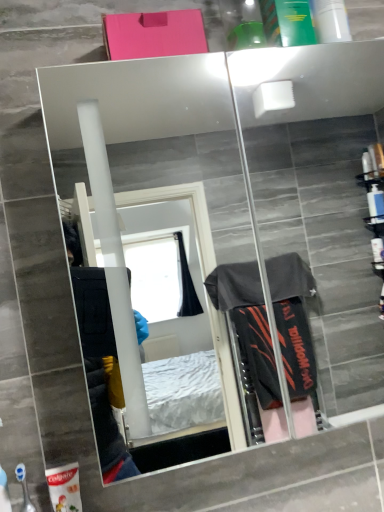
Question: Is point (23, 472) closer or farther from the camera than point (69, 483)?

Choices:
 (A) closer
 (B) farther

Answer: (B)

Question: Based on their sizes in the image, would you say blue plastic toothbrush at lower left, positioned as the 2th toiletry in back-to-front order, is bigger or smaller than white matte toothpaste tube at lower left, the second toiletry when ordered from front to back?

Choices:
 (A) big
 (B) small

Answer: (B)

Question: Estimate the real-world distances between objects in this image. Which object is farther from the white matte toothpaste tube at lower left, arranged as the first toiletry when viewed from the back?

Choices:
 (A) mirror glass at upper center
 (B) blue plastic toothbrush at lower left, positioned as the 2th toiletry in back-to-front order

Answer: (A)

Question: Based on their relative distances, which object is farther from the white matte toothpaste tube at lower left, arranged as the first toiletry when viewed from the back?

Choices:
 (A) mirror glass at upper center
 (B) blue plastic toothbrush at lower left, positioned as the 2th toiletry in back-to-front order

Answer: (A)